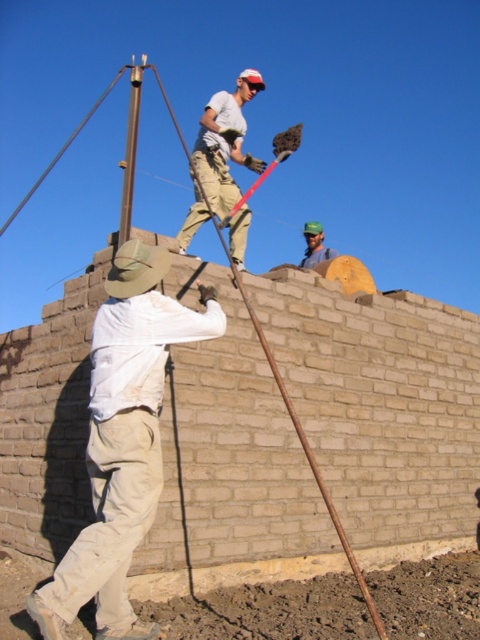
Based on the photo, you are a safety inspector observing the construction site. You notice two workers wearing the white cotton shirt at center and the matte khaki pants at upper center. According to safety protocols, workers must not stand above others without proper fall protection. Is there a violation here based on their positions?

The white cotton shirt at center is located below the matte khaki pants at upper center, meaning the worker in matte khaki pants at upper center is standing above the other worker. Since they are positioned above without mentioned fall protection, this violates safety protocols.

You are a safety inspector at a construction site. You need to ensure that the distance between the worker wearing the white cotton shirt at center and the worker wearing the green fabric cap at upper center is at least 6 meters to comply with safety regulations. Is the current distance compliant?

The distance between the white cotton shirt at center and the green fabric cap at upper center is 5.85 meters, which is less than the required 6 meters. Therefore, the current distance does not comply with safety regulations.

Consider the image. Based on the coordinates provided, which object is located at point (x=225, y=141) in the image?

The point (x=225, y=141) corresponds to the location of the matte khaki pants at upper center.